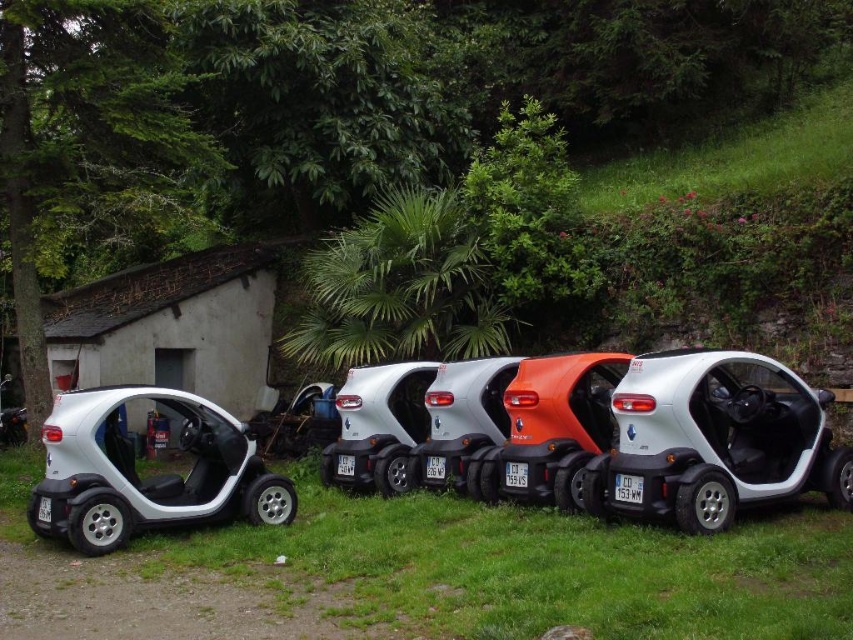
In the scene shown: You are standing in front of the Renault Twizy electric vehicles parked on the grassy area. You notice two points marked in the scene. Which point is closer to you, point (x=689, y=413) or point (x=413, y=413)?

Point (x=689, y=413) is closer to the viewer than point (x=413, y=413).

You are a gardener planning to mow the lawn in the area where the green grass at center and the satin silver car at center are located. Considering the space they occupy, which area will require less time to mow?

The green grass at center occupies less space than the satin silver car at center, so it will require less time to mow the green grass at center.

You are standing at the point labeled as point (548, 566) in the image. What is the immediate surface you are standing on?

The point (548, 566) corresponds to green grass at center, so you are standing on green grass at center.